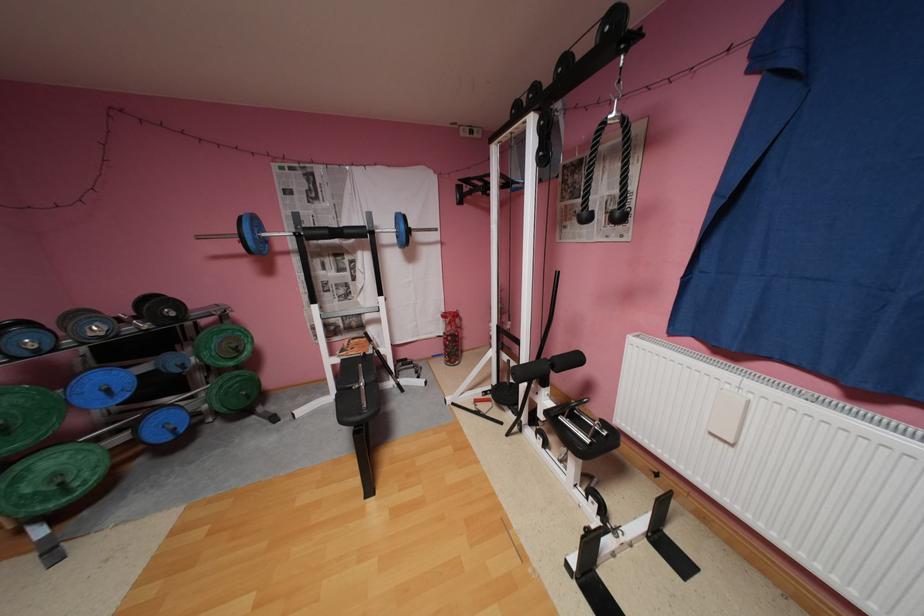
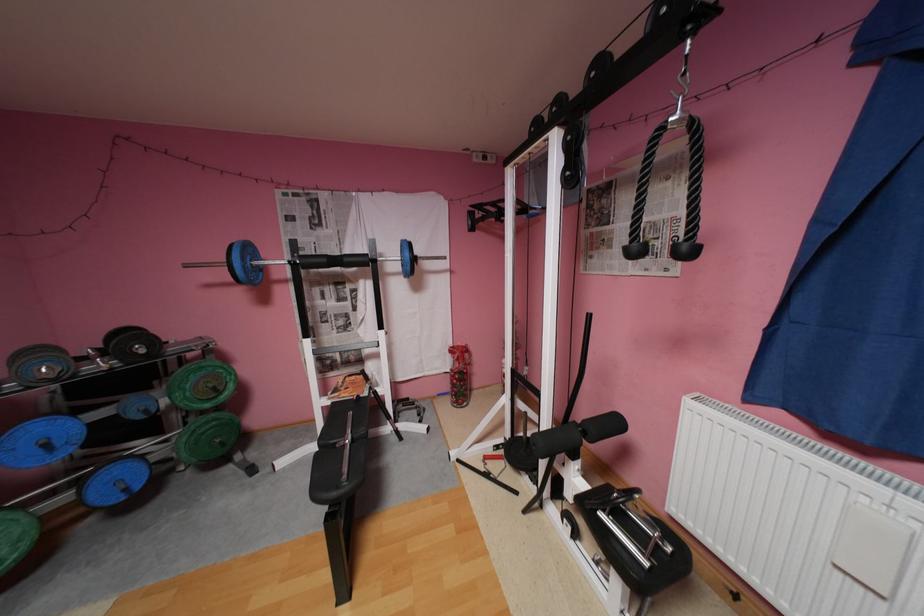
Find the pixel in the second image that matches [355,231] in the first image.

(355, 259)